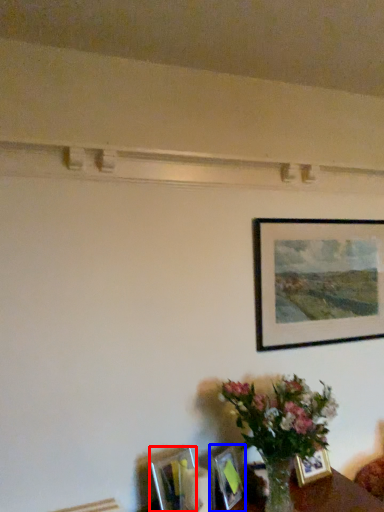
Question: Which object appears closest to the camera in this image, picture frame (highlighted by a red box) or picture frame (highlighted by a blue box)?

Choices:
 (A) picture frame
 (B) picture frame

Answer: (A)